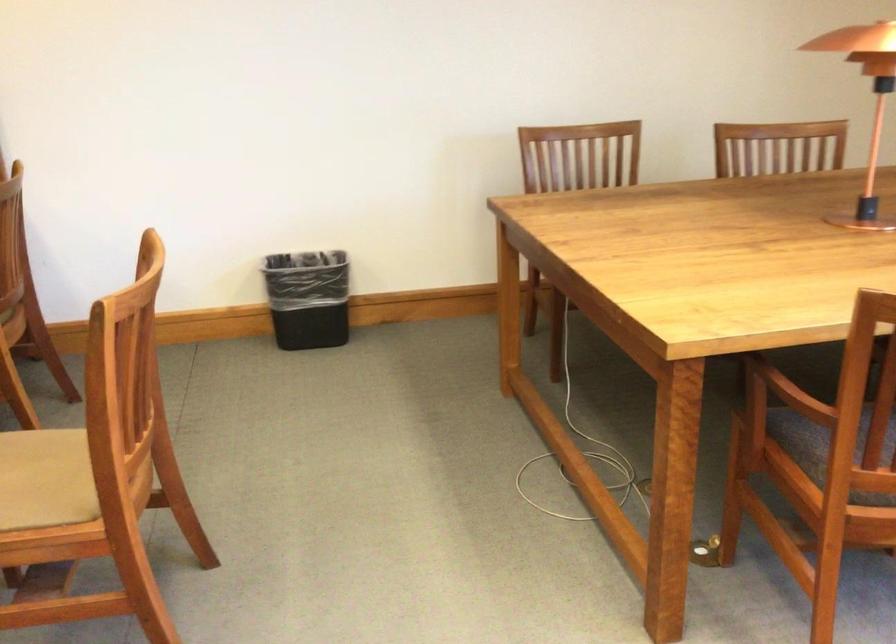
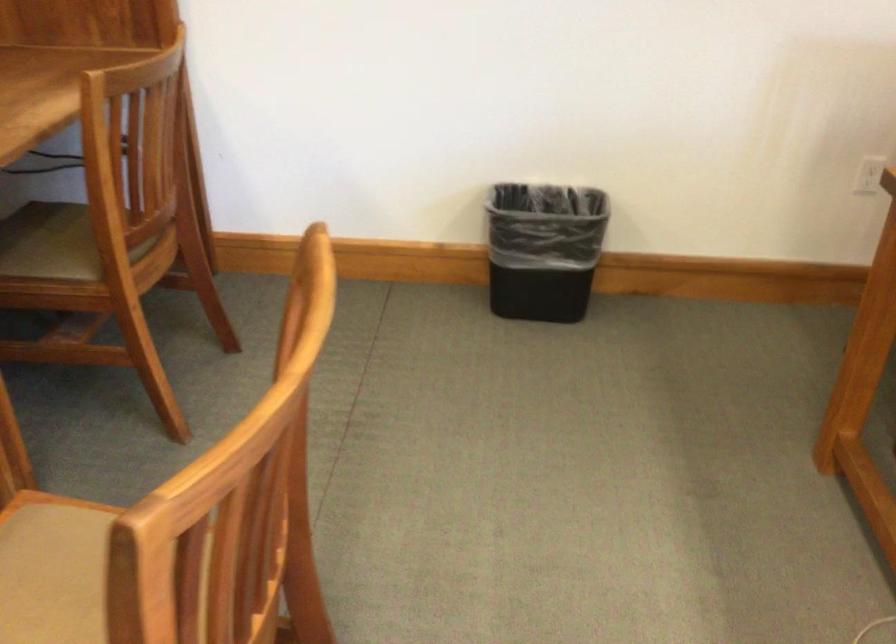
Question: The images are taken continuously from a first-person perspective. In which direction is your viewpoint rotating?

Choices:
 (A) Left
 (B) Right
 (C) Up
 (D) Down

Answer: (A)